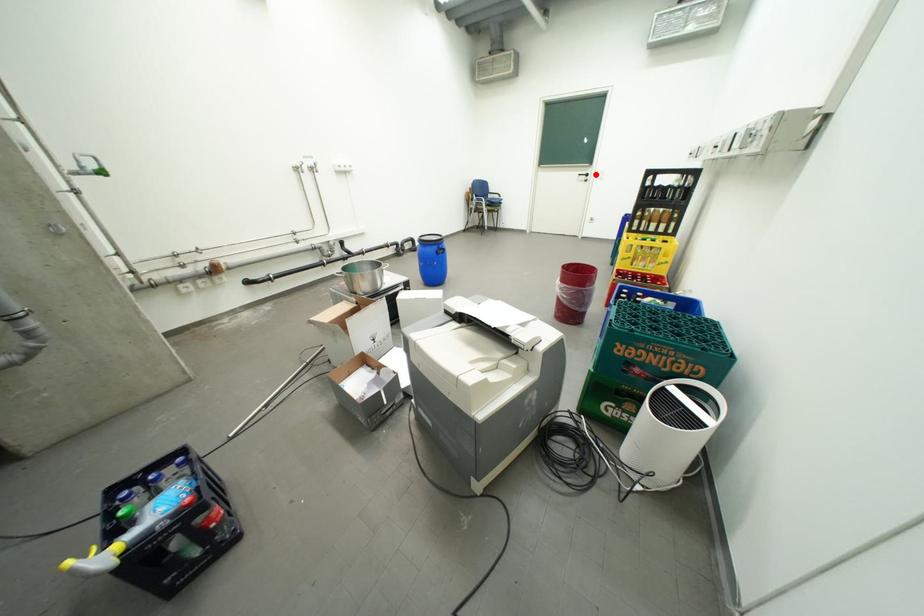
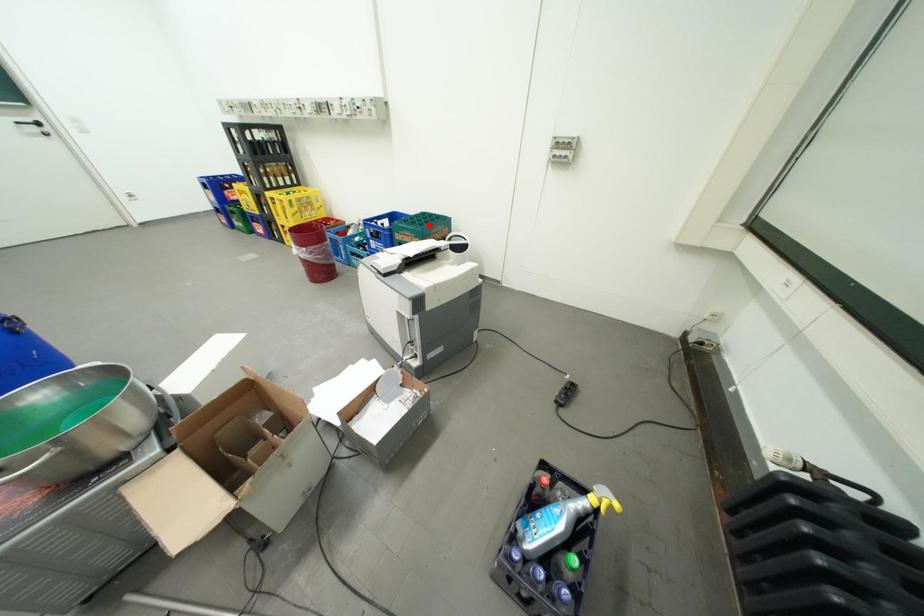
I am providing you with two images of the same scene from different viewpoints. A red point is marked on the first image and another point is marked on the second image. Do the highlighted points in image1 and image2 indicate the same real-world spot?

No